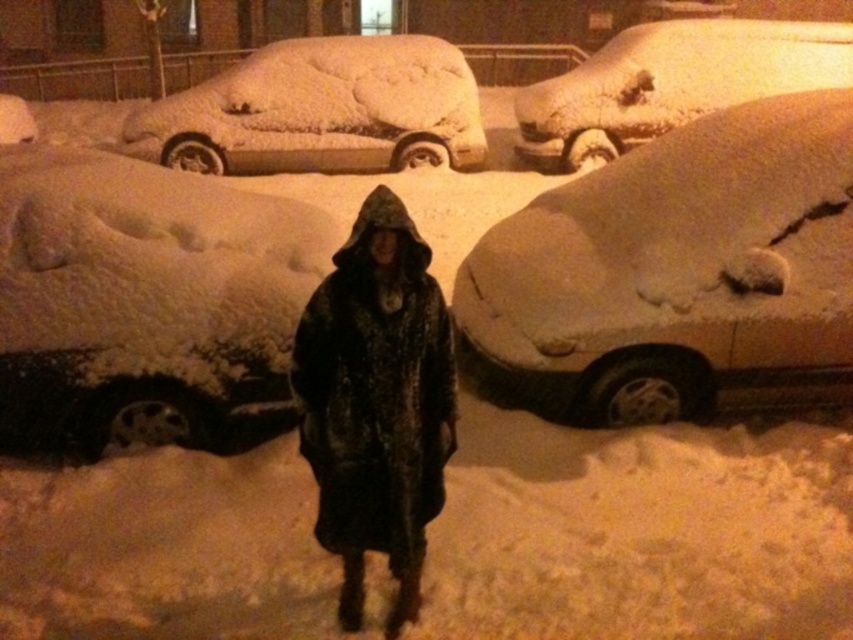
Question: Can you confirm if snow-covered car at right is thinner than dark brown textured fur coat at center?

Choices:
 (A) no
 (B) yes

Answer: (A)

Question: Which object is positioned farthest from the white fluffy snow at left?

Choices:
 (A) snow-covered car at upper left
 (B) snow-covered car at right
 (C) dark brown textured fur coat at center

Answer: (C)

Question: Estimate the real-world distances between objects in this image. Which object is farther from the snow-covered car at upper right?

Choices:
 (A) snow-covered car at right
 (B) white fluffy snow at left
 (C) snow-covered car at upper left
 (D) dark brown textured fur coat at center

Answer: (B)

Question: Does dark brown textured fur coat at center appear on the right side of white fluffy snow at left?

Choices:
 (A) yes
 (B) no

Answer: (A)

Question: Does snow-covered car at right appear under snow-covered car at upper left?

Choices:
 (A) no
 (B) yes

Answer: (B)

Question: Which of the following is the farthest from the observer?

Choices:
 (A) snow-covered car at right
 (B) dark brown textured fur coat at center
 (C) snow-covered car at upper left

Answer: (C)